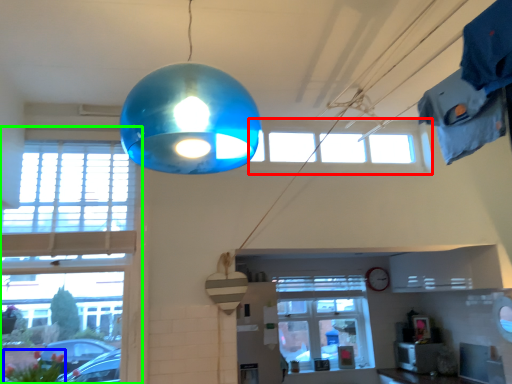
Question: Estimate the real-world distances between objects in this image. Which object is closer to window (highlighted by a red box), flower (highlighted by a blue box) or window (highlighted by a green box)?

Choices:
 (A) flower
 (B) window

Answer: (B)